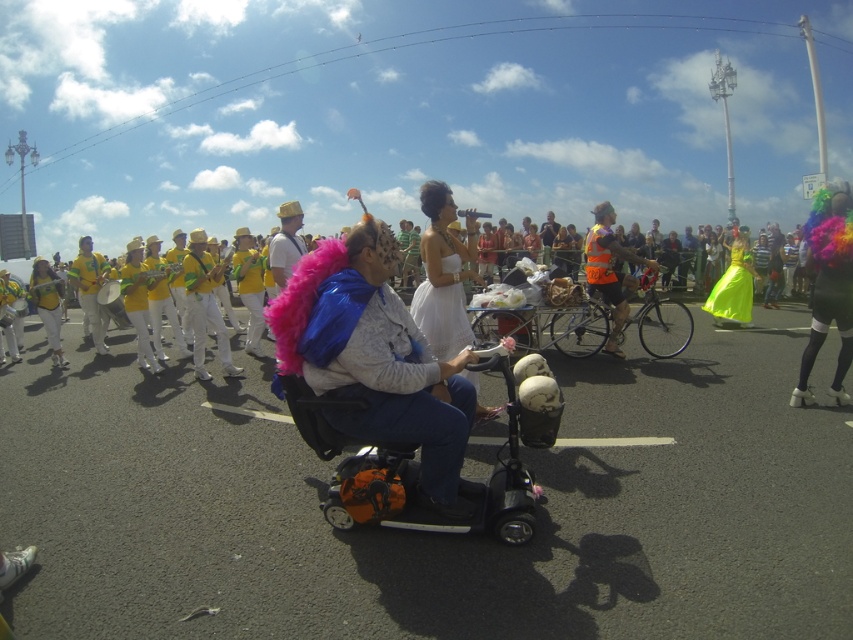
Can you confirm if orange reflective vest at center is bigger than neon yellow satin dress at right?

Actually, orange reflective vest at center might be smaller than neon yellow satin dress at right.

Which is in front, point (612, 220) or point (747, 312)?

Positioned in front is point (612, 220).

The height and width of the screenshot is (640, 853). I want to click on orange reflective vest at center, so click(x=610, y=269).

This screenshot has height=640, width=853. Identify the location of orange reflective vest at center. (610, 269).

Does point (489, 524) come closer to viewer compared to point (445, 356)?

Yes.

Is black plastic scooter at center to the right of white satin dress at center from the viewer's perspective?

In fact, black plastic scooter at center is to the left of white satin dress at center.

At what (x,y) coordinates should I click in order to perform the action: click on black plastic scooter at center. Please return your answer as a coordinate pair (x, y). Looking at the image, I should click on (415, 474).

Does point (419, 189) come closer to viewer compared to point (747, 250)?

No, (419, 189) is further to viewer.

Is point (439, 216) farther from viewer compared to point (744, 273)?

No.

What do you see at coordinates (444, 273) in the screenshot?
I see `white satin dress at center` at bounding box center [444, 273].

This screenshot has height=640, width=853. Find the location of `white satin dress at center`. white satin dress at center is located at coordinates (444, 273).